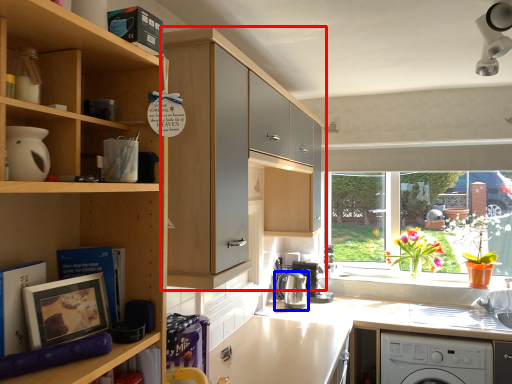
Question: Which of the following is the farthest to the observer, cabinetry (highlighted by a red box) or kitchen appliance (highlighted by a blue box)?

Choices:
 (A) cabinetry
 (B) kitchen appliance

Answer: (B)